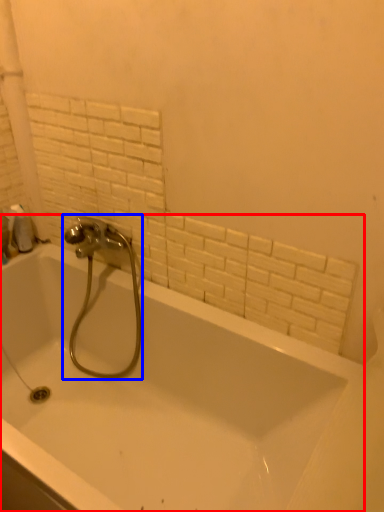
Question: Which point is further to the camera, bathtub (highlighted by a red box) or tap (highlighted by a blue box)?

Choices:
 (A) bathtub
 (B) tap

Answer: (B)